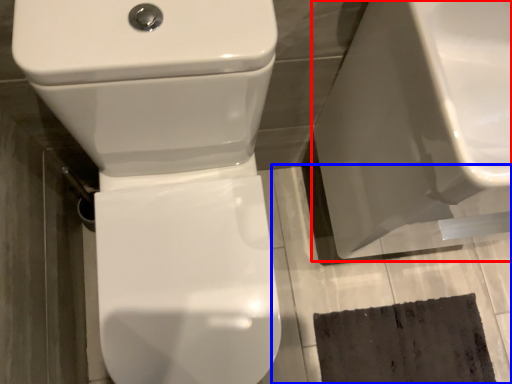
Question: Among these objects, which one is farthest to the camera, porcelain (highlighted by a red box) or concrete (highlighted by a blue box)?

Choices:
 (A) porcelain
 (B) concrete

Answer: (B)